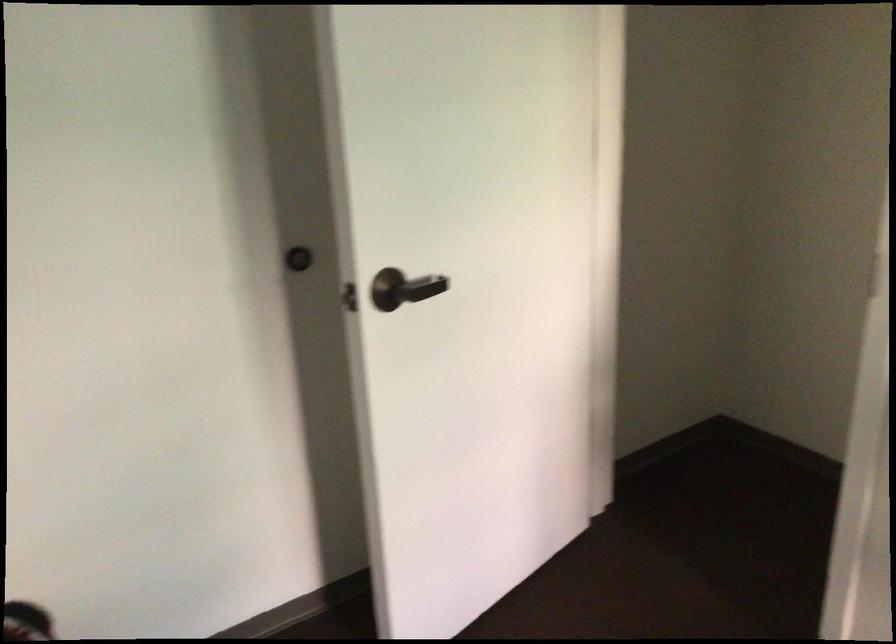
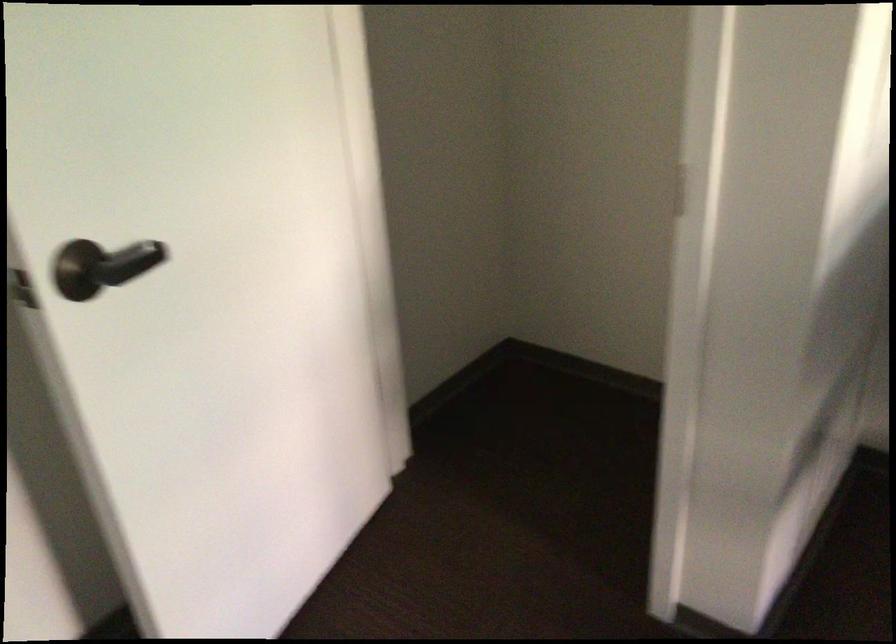
Question: Which direction would the cameraman need to move to produce the second image? Reply with the corresponding letter.

Choices:
 (A) Left
 (B) Right
 (C) Forward
 (D) Backward

Answer: (C)